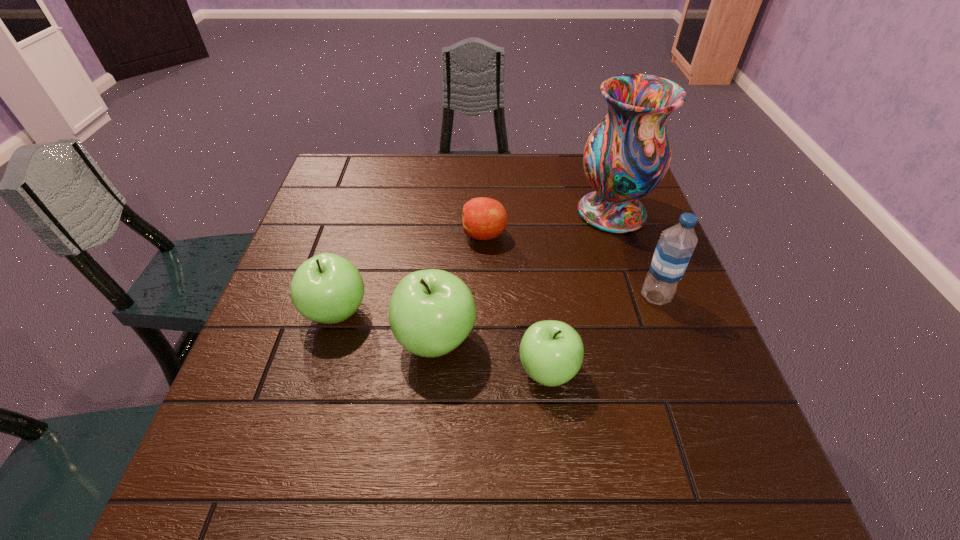
The width and height of the screenshot is (960, 540). In order to click on the leftmost object in this screenshot , I will do `click(327, 288)`.

The image size is (960, 540). I want to click on the leftmost apple, so click(x=327, y=288).

Where is `the third object from right to left`? This screenshot has height=540, width=960. the third object from right to left is located at coordinates (551, 352).

At what (x,y) coordinates should I click in order to perform the action: click on the fifth shortest object. Please return your answer as a coordinate pair (x, y). The width and height of the screenshot is (960, 540). Looking at the image, I should click on (674, 249).

Locate an element on the screen. Image resolution: width=960 pixels, height=540 pixels. the shortest object is located at coordinates (483, 218).

Find the location of a particular element. The image size is (960, 540). the farthest apple is located at coordinates (483, 218).

Find the location of a particular element. the tallest object is located at coordinates (626, 157).

You are a GUI agent. You are given a task and a screenshot of the screen. Output one action in this format:
    pyautogui.click(x=<x>, y=<y>)
    Task: Click on the free space located 0.190m on the back of the fourth tallest object
    
    Given the screenshot: What is the action you would take?
    pyautogui.click(x=359, y=234)

Identify the location of vacant space located on the left of the rightmost apple. This screenshot has height=540, width=960. (351, 371).

Locate an element on the screen. vacant space situated 0.100m on the label of the fifth shortest object is located at coordinates (595, 296).